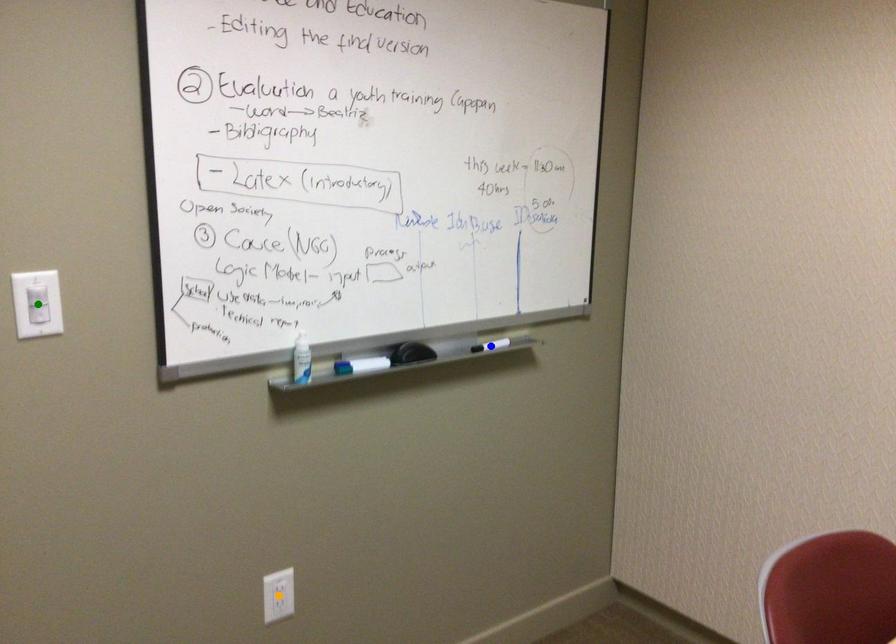
Order these from nearest to farthest:
blue point | orange point | green point

green point, orange point, blue point